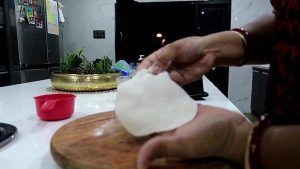
What are the coordinates of `white wall with grey marbling` in the screenshot? It's located at (81, 12), (250, 13).